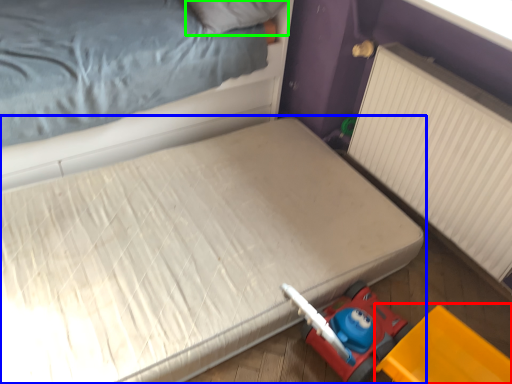
Question: Which object is positioned farthest from equipment (highlighted by a red box)? Select from bed (highlighted by a blue box) and pillow (highlighted by a green box).

Choices:
 (A) bed
 (B) pillow

Answer: (B)